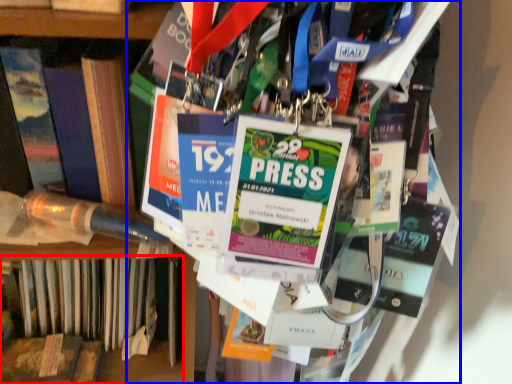
Question: Which point is further to the camera, book (highlighted by a red box) or book (highlighted by a blue box)?

Choices:
 (A) book
 (B) book

Answer: (A)